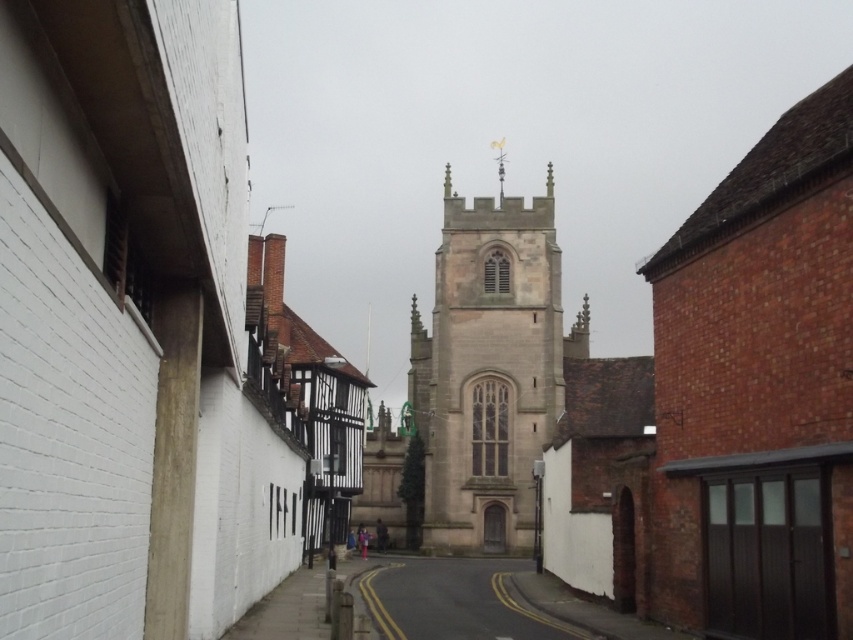
Does light brown stone tower at center appear on the left side of smooth asphalt road at center?

Incorrect, light brown stone tower at center is not on the left side of smooth asphalt road at center.

Based on the photo, is light brown stone tower at center below smooth asphalt road at center?

Actually, light brown stone tower at center is above smooth asphalt road at center.

Identify the location of light brown stone tower at center. This screenshot has width=853, height=640. click(486, 371).